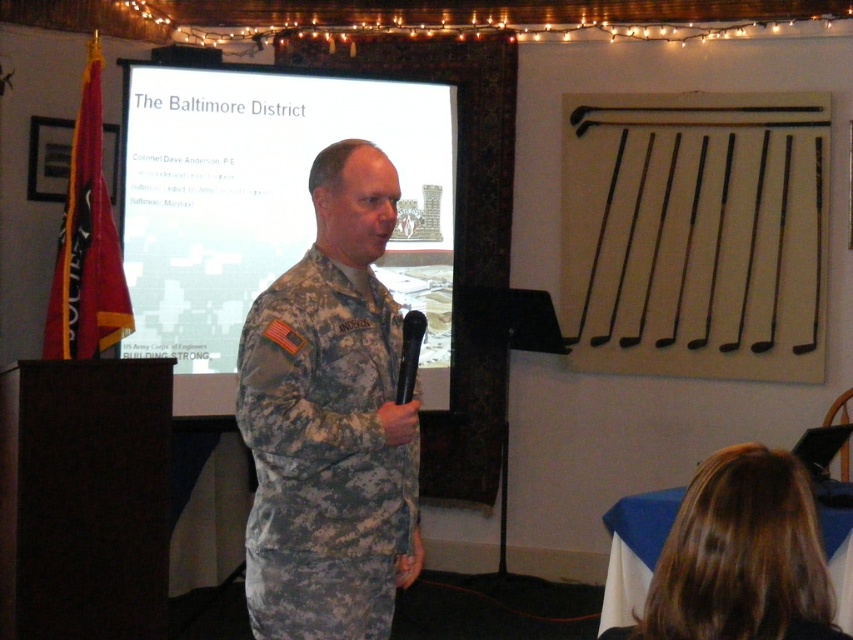
Question: Among these points, which one is farthest from the camera?

Choices:
 (A) (345, 464)
 (B) (735, 611)

Answer: (A)

Question: Is white matte projection screen at center positioned in front of camouflage uniform at center?

Choices:
 (A) yes
 (B) no

Answer: (B)

Question: Which point is farther from the camera taking this photo?

Choices:
 (A) (746, 448)
 (B) (318, 330)
 (C) (245, 195)

Answer: (C)

Question: Is white matte projection screen at center above camouflage uniform at center?

Choices:
 (A) yes
 (B) no

Answer: (A)

Question: Which point is farther to the camera?

Choices:
 (A) white matte projection screen at center
 (B) camouflage uniform at center
 (C) camouflage fabric uniform at center

Answer: (A)

Question: Does camouflage fabric uniform at center appear over camouflage uniform at center?

Choices:
 (A) yes
 (B) no

Answer: (A)